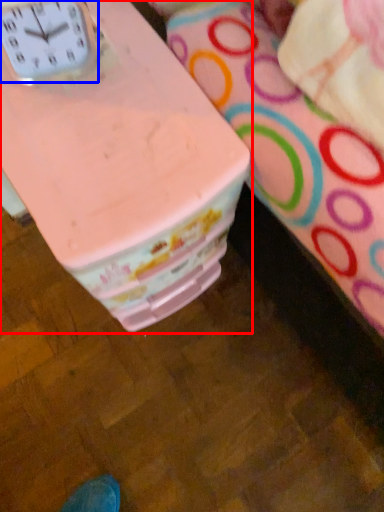
Question: Which object appears closest to the camera in this image, table (highlighted by a red box) or clock (highlighted by a blue box)?

Choices:
 (A) table
 (B) clock

Answer: (B)